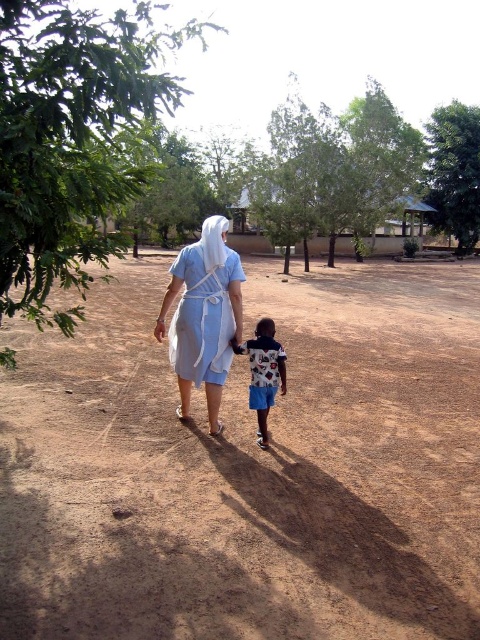
The height and width of the screenshot is (640, 480). What do you see at coordinates (454, 172) in the screenshot?
I see `green leafy tree at upper right` at bounding box center [454, 172].

Is green leafy tree at upper right to the left of printed cotton shirt at center from the viewer's perspective?

No, green leafy tree at upper right is not to the left of printed cotton shirt at center.

What are the coordinates of `green leafy tree at upper right` in the screenshot? It's located at (454, 172).

Which is behind, point (204, 305) or point (279, 372)?

Point (204, 305)

This screenshot has height=640, width=480. I want to click on matte blue dress at center, so click(203, 316).

Can you confirm if brown sandy ground at center is bigger than green leafy tree at left?

Actually, brown sandy ground at center might be smaller than green leafy tree at left.

Who is taller, brown sandy ground at center or green leafy tree at left?

With more height is green leafy tree at left.

Which is behind, point (309, 634) or point (74, 161)?

The point (74, 161) is more distant.

The height and width of the screenshot is (640, 480). I want to click on brown sandy ground at center, so 250,468.